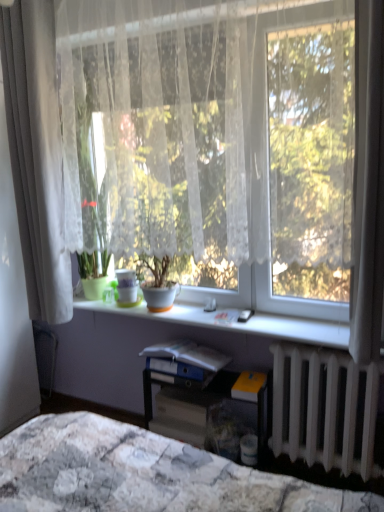
Question: Is matte gray paperback book at center, the first paperback book when ordered from bottom to top, surrounded by matte white pot at center, placed as the first houseplant when sorted from right to left?

Choices:
 (A) yes
 (B) no

Answer: (B)

Question: Is matte white pot at center, which is counted as the 2th houseplant, starting from the left, not near matte gray paperback book at center, the first paperback book when ordered from bottom to top?

Choices:
 (A) yes
 (B) no

Answer: (B)

Question: Is matte white pot at center, placed as the first houseplant when sorted from right to left, oriented away from matte gray paperback book at center, the first paperback book when ordered from bottom to top?

Choices:
 (A) yes
 (B) no

Answer: (B)

Question: Is matte white pot at center, placed as the first houseplant when sorted from right to left, shorter than matte gray paperback book at center, the 3th paperback book in the top-to-bottom sequence?

Choices:
 (A) yes
 (B) no

Answer: (B)

Question: Is matte white pot at center, placed as the first houseplant when sorted from right to left, aimed at matte gray paperback book at center, the first paperback book when ordered from bottom to top?

Choices:
 (A) no
 (B) yes

Answer: (A)

Question: From the image's perspective, is blue matte folder at center, which appears as the 3th paperback book when ordered from the bottom, positioned above or below matte plastic desk at center?

Choices:
 (A) below
 (B) above

Answer: (B)

Question: Visually, is blue matte folder at center, which appears as the 3th paperback book when ordered from the bottom, positioned to the left or to the right of matte plastic desk at center?

Choices:
 (A) left
 (B) right

Answer: (A)

Question: Based on their sizes in the image, would you say blue matte folder at center, which appears as the 3th paperback book when ordered from the bottom, is bigger or smaller than matte plastic desk at center?

Choices:
 (A) big
 (B) small

Answer: (B)

Question: Considering their positions, is blue matte folder at center, which appears as the 3th paperback book when ordered from the bottom, located in front of or behind matte plastic desk at center?

Choices:
 (A) front
 (B) behind

Answer: (B)

Question: Based on their positions, is white glossy window sill at center located to the left or right of green matte pot at center, the 1th houseplant in the left-to-right sequence?

Choices:
 (A) right
 (B) left

Answer: (A)

Question: From the image's perspective, relative to green matte pot at center, placed as the second houseplant when sorted from right to left, is white glossy window sill at center above or below?

Choices:
 (A) below
 (B) above

Answer: (A)

Question: Is point (276, 328) positioned closer to the camera than point (94, 273)?

Choices:
 (A) closer
 (B) farther

Answer: (A)

Question: From a real-world perspective, is white glossy window sill at center positioned above or below green matte pot at center, placed as the second houseplant when sorted from right to left?

Choices:
 (A) above
 (B) below

Answer: (B)

Question: Considering the positions of yellow matte paperback book at lower right, acting as the second paperback book starting from the top, and white sheer curtain at left in the image, is yellow matte paperback book at lower right, acting as the second paperback book starting from the top, taller or shorter than white sheer curtain at left?

Choices:
 (A) short
 (B) tall

Answer: (A)

Question: From the image's perspective, is yellow matte paperback book at lower right, acting as the second paperback book starting from the top, positioned above or below white sheer curtain at left?

Choices:
 (A) above
 (B) below

Answer: (B)